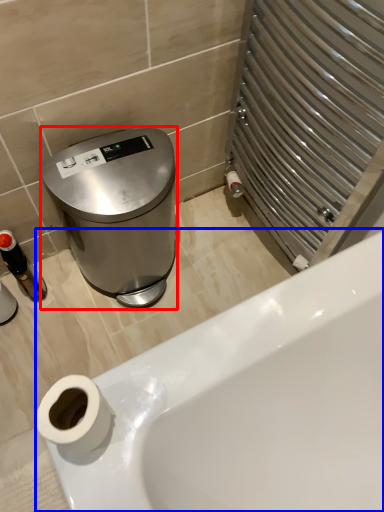
Question: Which object is further to the camera taking this photo, appliance (highlighted by a red box) or bathtub (highlighted by a blue box)?

Choices:
 (A) appliance
 (B) bathtub

Answer: (B)